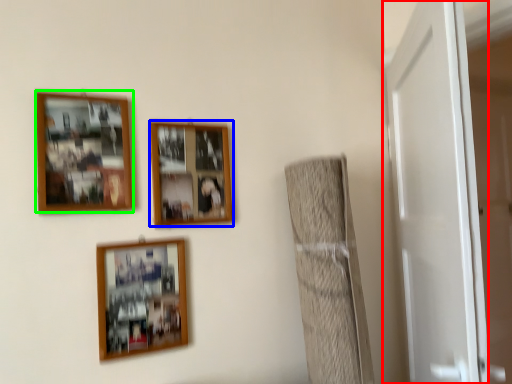
Question: Which is farther away from door (highlighted by a red box)? picture frame (highlighted by a blue box) or picture frame (highlighted by a green box)?

Choices:
 (A) picture frame
 (B) picture frame

Answer: (B)